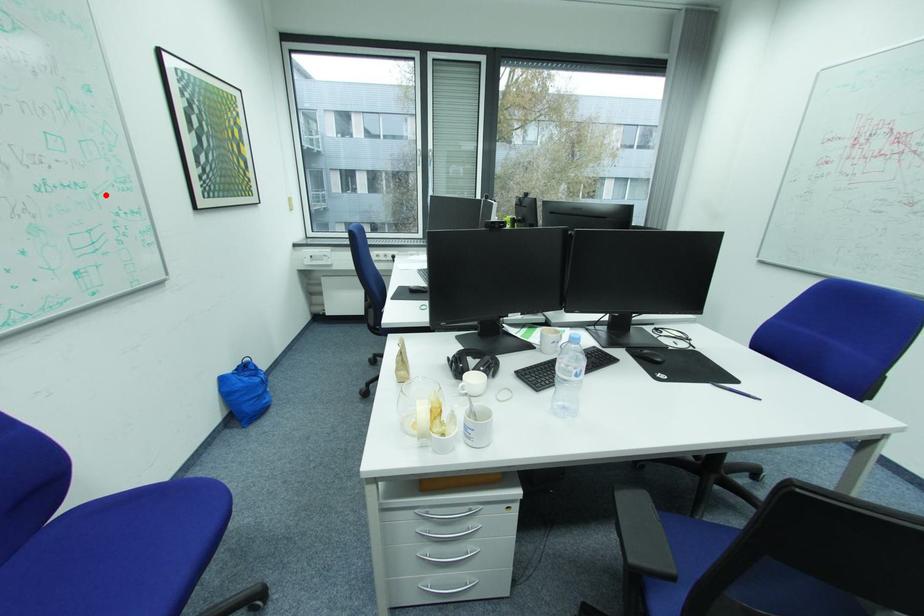
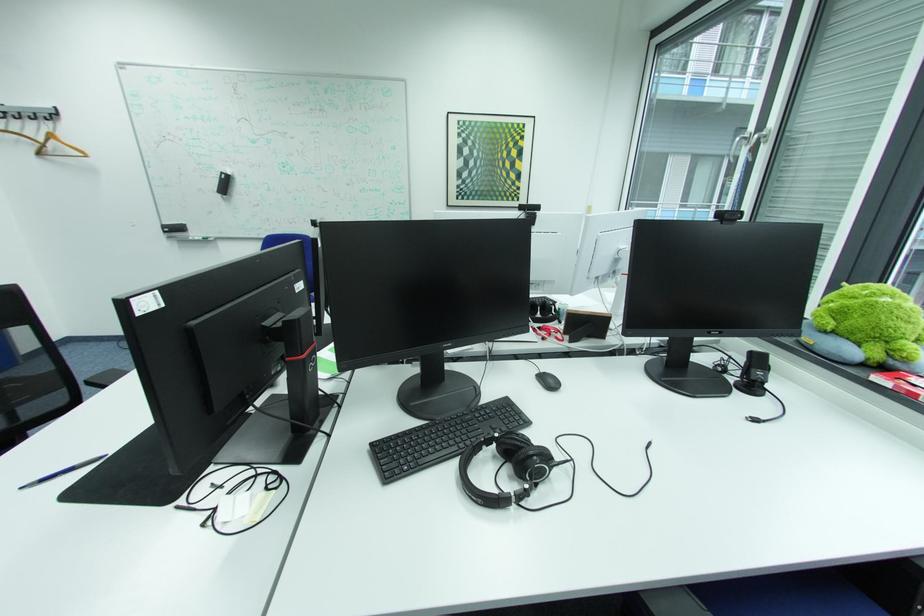
Locate, in the second image, the point that corresponds to the highlighted location in the first image.

(393, 195)